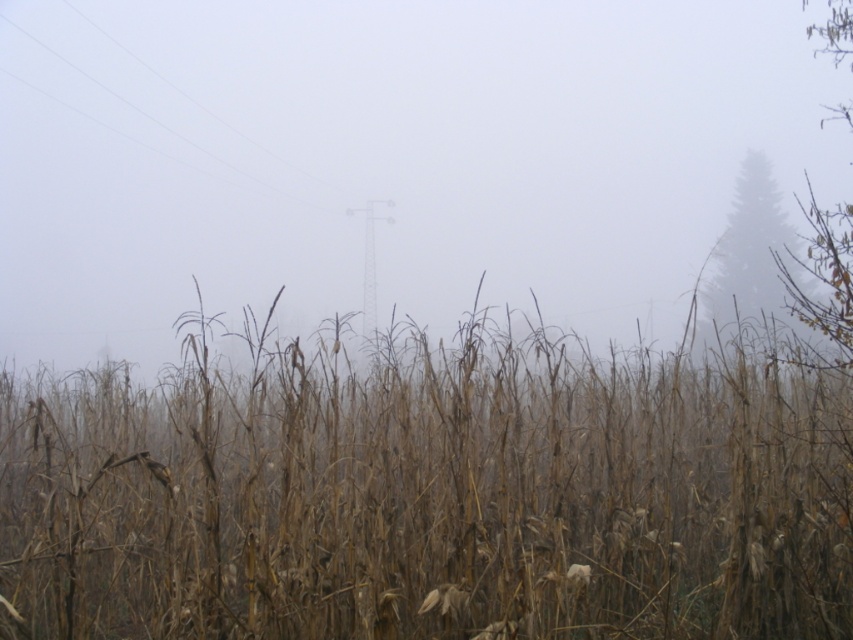
Who is positioned more to the right, foggy atmosphere at center or clear wire at upper left?

foggy atmosphere at center is more to the right.

Is foggy atmosphere at center smaller than clear wire at upper left?

Incorrect, foggy atmosphere at center is not smaller in size than clear wire at upper left.

At what (x,y) coordinates should I click in order to perform the action: click on foggy atmosphere at center. Please return your answer as a coordinate pair (x, y). Looking at the image, I should click on (386, 157).

Locate an element on the screen. The height and width of the screenshot is (640, 853). foggy atmosphere at center is located at coordinates (386, 157).

Does foggy atmosphere at center appear over green matte tree at upper right?

Yes.

Who is higher up, foggy atmosphere at center or green matte tree at upper right?

foggy atmosphere at center

The image size is (853, 640). Find the location of `foggy atmosphere at center`. foggy atmosphere at center is located at coordinates (386, 157).

The height and width of the screenshot is (640, 853). I want to click on foggy atmosphere at center, so click(x=386, y=157).

Who is lower down, brown dry grass at center or green matte tree at upper right?

Positioned lower is brown dry grass at center.

Can you confirm if brown dry grass at center is taller than green matte tree at upper right?

In fact, brown dry grass at center may be shorter than green matte tree at upper right.

This screenshot has height=640, width=853. Describe the element at coordinates (428, 497) in the screenshot. I see `brown dry grass at center` at that location.

The width and height of the screenshot is (853, 640). Find the location of `brown dry grass at center`. brown dry grass at center is located at coordinates (428, 497).